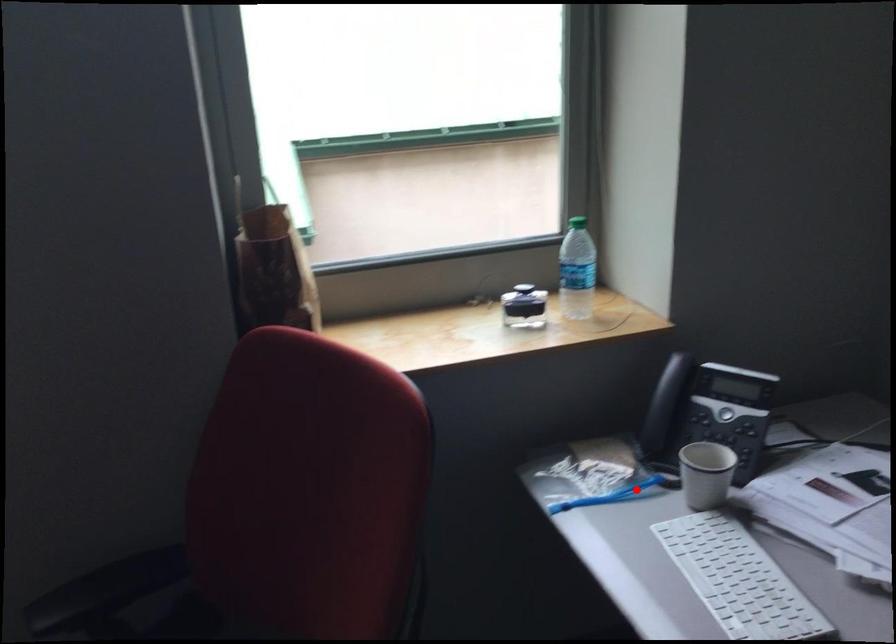
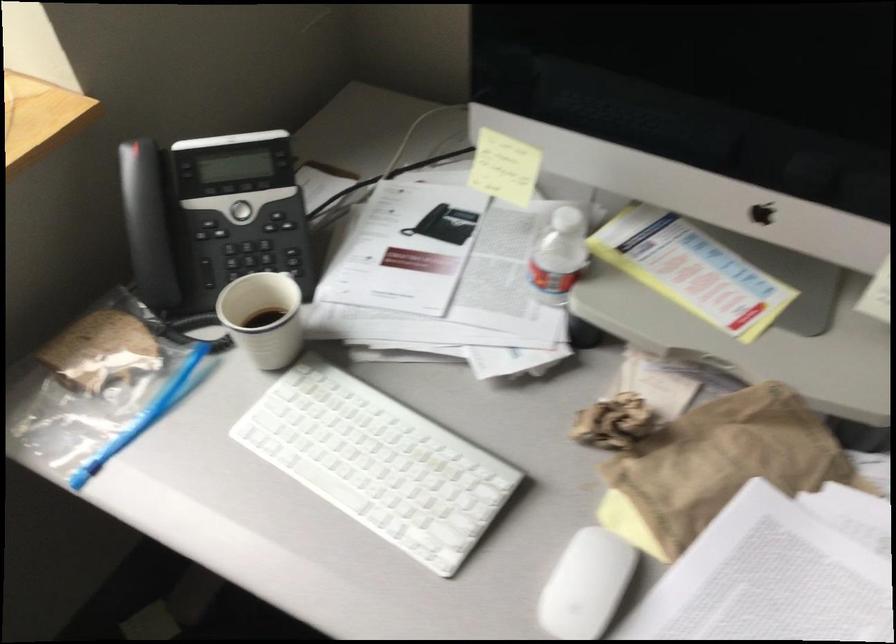
In the second image, find the point that corresponds to the highlighted location in the first image.

(173, 384)